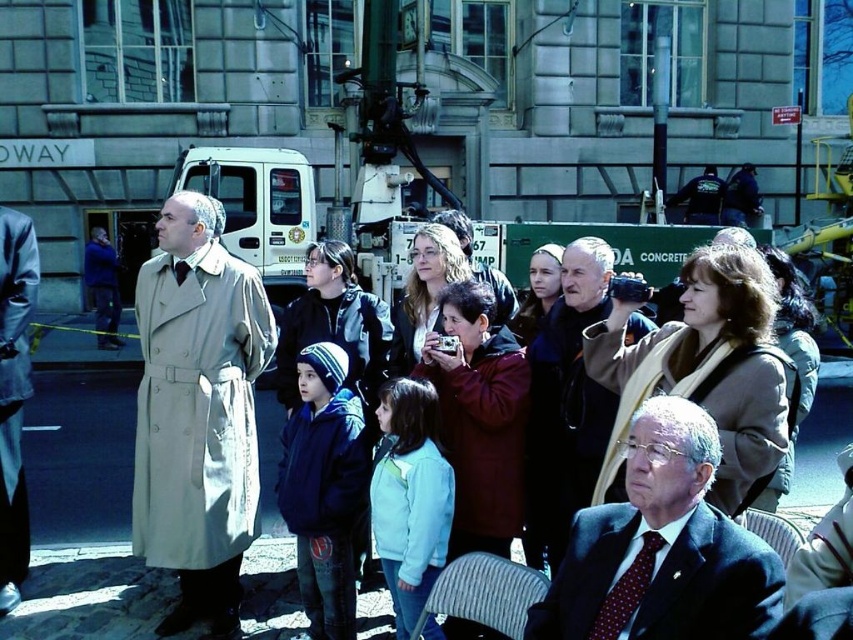
Is beige fabric trench coat at left to the right of light beige trench coat at left from the viewer's perspective?

Indeed, beige fabric trench coat at left is positioned on the right side of light beige trench coat at left.

Does beige fabric trench coat at left lie behind light beige trench coat at left?

No, it is in front of light beige trench coat at left.

Find the location of a particular element. Image resolution: width=853 pixels, height=640 pixels. beige fabric trench coat at left is located at coordinates (196, 412).

Between dark blue suit at lower right and brown leather jacket at center, which one appears on the left side from the viewer's perspective?

Positioned to the left is brown leather jacket at center.

Can you confirm if dark blue suit at lower right is thinner than brown leather jacket at center?

No.

Find the location of a particular element. The image size is (853, 640). dark blue suit at lower right is located at coordinates (660, 548).

Which is above, brown leather jacket at center or light beige trench coat at left?

light beige trench coat at left is higher up.

Is brown leather jacket at center to the right of light beige trench coat at left from the viewer's perspective?

Yes, brown leather jacket at center is to the right of light beige trench coat at left.

Measure the distance between brown leather jacket at center and camera.

brown leather jacket at center and camera are 7.60 meters apart from each other.

You are a GUI agent. You are given a task and a screenshot of the screen. Output one action in this format:
    pyautogui.click(x=<x>, y=<y>)
    Task: Click on the brown leather jacket at center
    
    Given the screenshot: What is the action you would take?
    pyautogui.click(x=566, y=404)